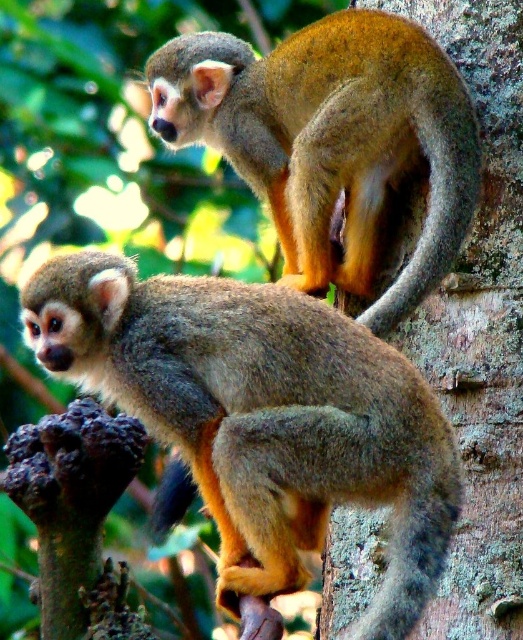
You are a wildlife photographer trying to capture both monkeys in a single photo. Given that the brown furry monkey at lower left is closer to your camera, will it appear larger in the photo compared to the golden fur monkey at upper center?

The brown furry monkey at lower left is smaller than the golden fur monkey at upper center, but since it is closer to the camera, it may appear larger in the photo depending on the distance difference and camera lens used.

You are a photographer aiming to capture both monkeys in a single shot. Since the brown furry monkey at lower left is blocking the golden fur monkey at upper center, which monkey should you adjust your camera angle to focus on first to ensure both are visible?

You should focus on the brown furry monkey at lower left first because it is in front of the golden fur monkey at upper center. By adjusting the angle to include the front monkey, you can ensure the one behind is also visible in the background.

You are observing two squirrel monkeys in a forest. You see a brown furry monkey at lower left and another monkey. Which monkey is positioned closer to the viewer?

The brown furry monkey at lower left is closer to the viewer because it is located at point [262,417], which is lower and thus nearer in the image coordinate system.